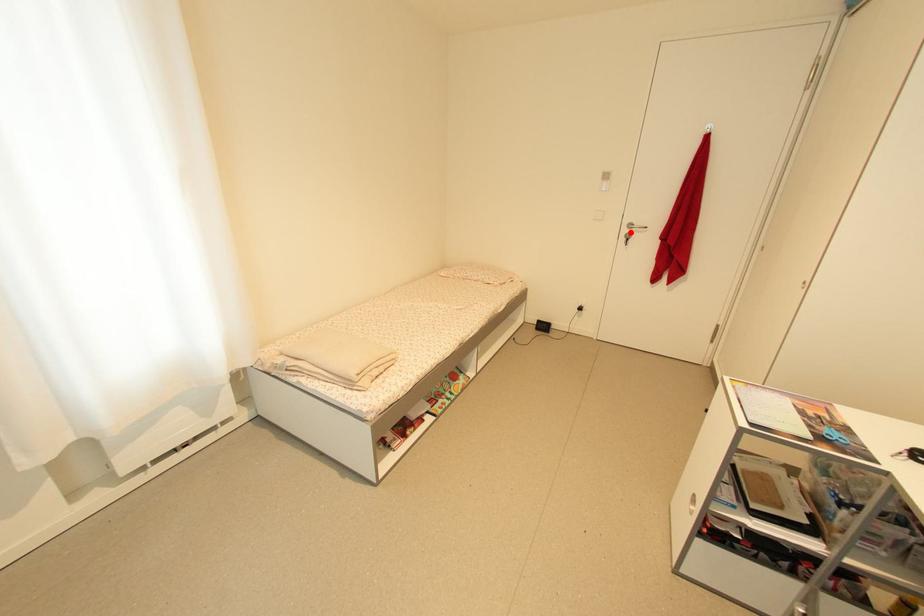
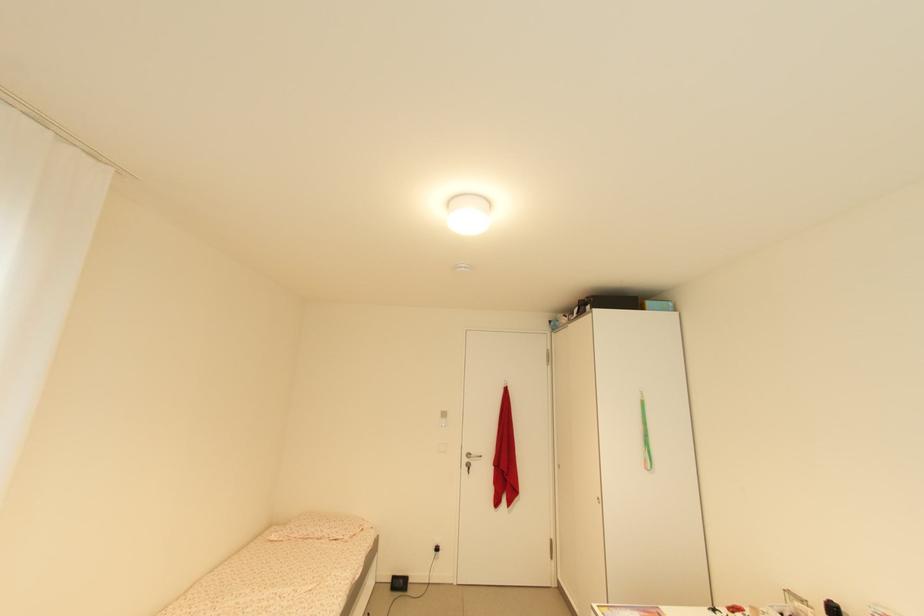
Question: I am providing you with two images of the same scene from different viewpoints. Given a red point in image1, look at the same physical point in image2. Is it:

Choices:
 (A) Closer to the viewpoint
 (B) Farther from the viewpoint

Answer: (B)